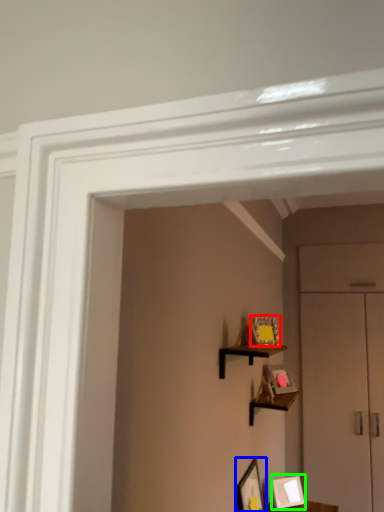
Question: Based on their relative distances, which object is farther from picture frame (highlighted by a red box)? Choose from picture frame (highlighted by a blue box) and picture frame (highlighted by a green box).

Choices:
 (A) picture frame
 (B) picture frame

Answer: (B)